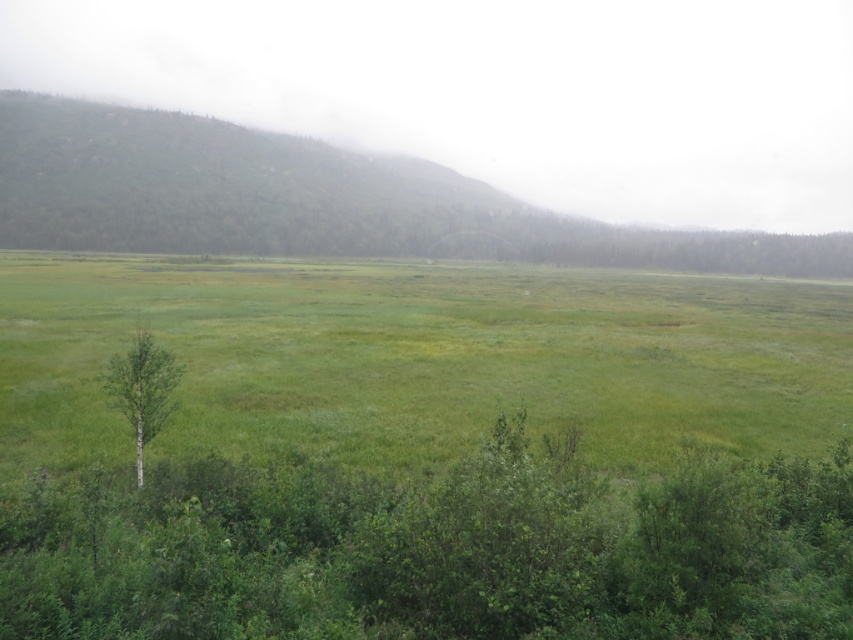
You are a hiker trying to navigate through the grassy field. You notice two trees in the distance. Which tree, the green leafy tree at lower left or the green matte tree at left, would you use as a landmark if you want to mark a wider path?

The green leafy tree at lower left might be wider than green matte tree at left, so it would be a better landmark for marking a wider path.

You are a hiker who wants to take a photo of both the green leafy tree at lower left and the green matte tree at left. Which tree should you stand closer to in order to capture both in the same frame?

To capture both the green leafy tree at lower left and the green matte tree at left in the same frame, you should stand closer to the green leafy tree at lower left because it is positioned below the green matte tree at left, allowing for a wider angle to include both in the photo.